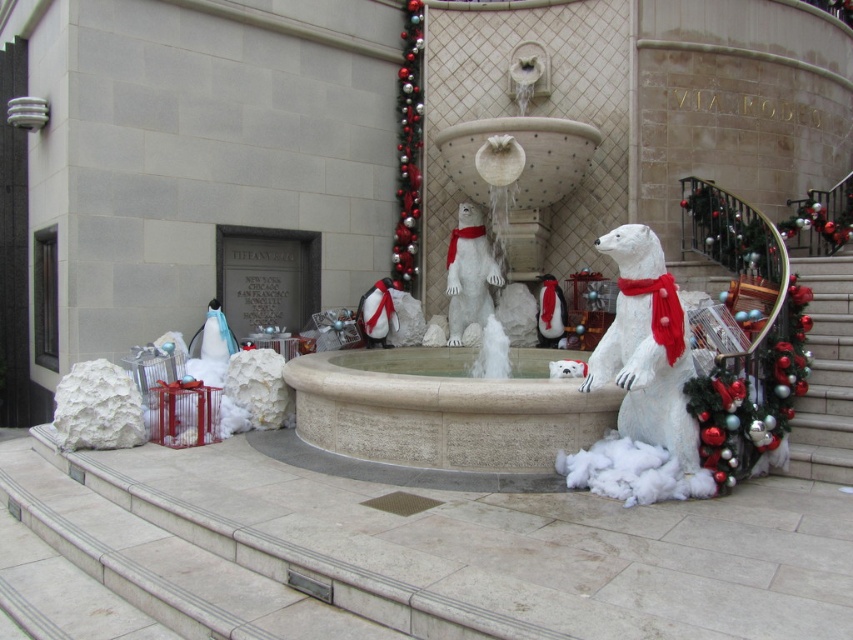
Question: Which object is positioned farthest from the smooth stone staircase at lower right?

Choices:
 (A) white paper bear at center
 (B) shiny metallic garland at center
 (C) white fluffy polar bear at center

Answer: (B)

Question: Can you confirm if white paper bear at center is bigger than shiny metallic garland at center?

Choices:
 (A) no
 (B) yes

Answer: (B)

Question: In this image, where is white paper bear at center located relative to smooth stone staircase at lower right?

Choices:
 (A) below
 (B) above

Answer: (B)

Question: Which point is farther to the camera?

Choices:
 (A) white fluffy polar bear at center
 (B) smooth stone staircase at lower right

Answer: (A)

Question: Is smooth stone staircase at lower right positioned in front of shiny metallic garland at center?

Choices:
 (A) yes
 (B) no

Answer: (A)

Question: Which of the following is the farthest from the observer?

Choices:
 (A) (393, 272)
 (B) (479, 304)

Answer: (A)